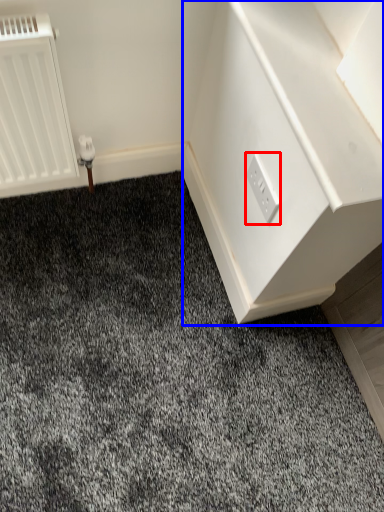
Question: Among these objects, which one is farthest to the camera, power plugs and sockets (highlighted by a red box) or dresser (highlighted by a blue box)?

Choices:
 (A) power plugs and sockets
 (B) dresser

Answer: (A)